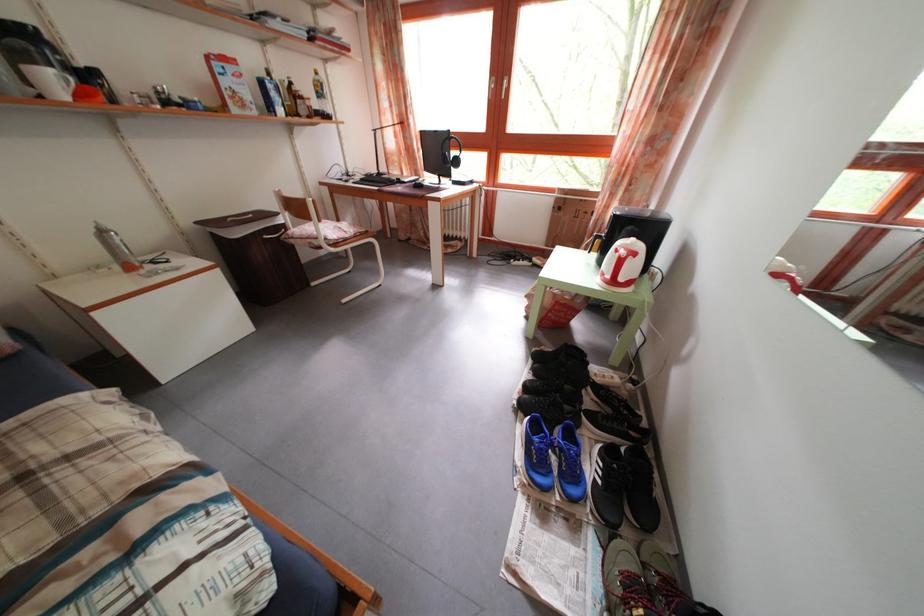
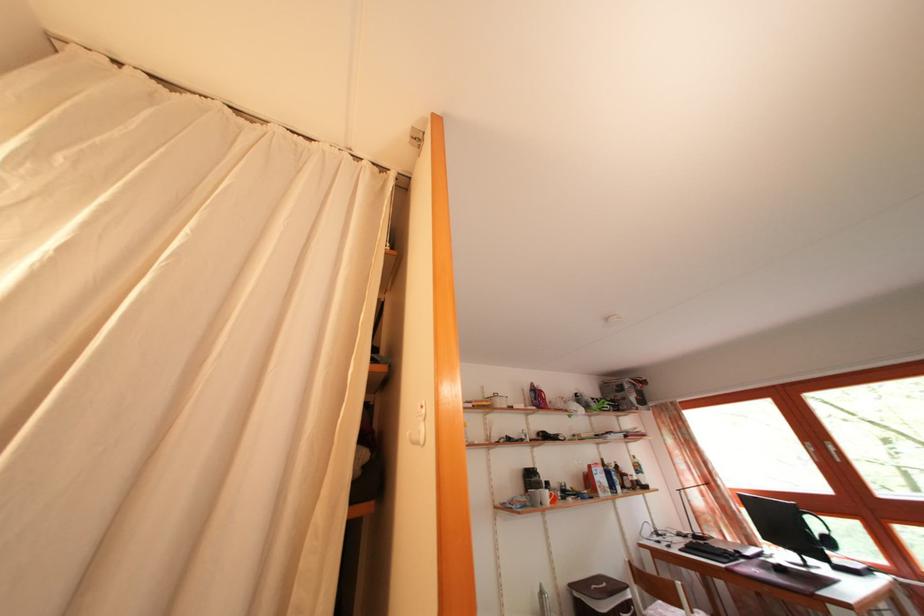
Locate, in the second image, the point that corresponds to point (465, 169) in the first image.

(837, 549)